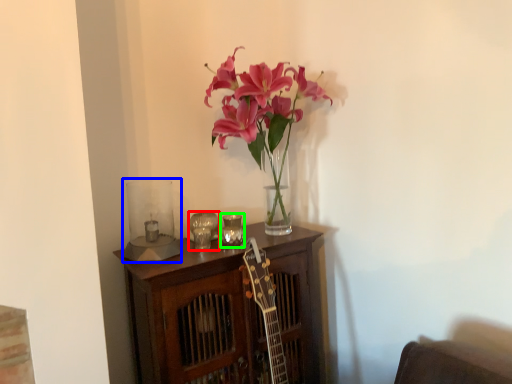
Question: Based on their relative distances, which object is nearer to candle holder (highlighted by a red box)? Choose from candle holder (highlighted by a blue box) and candle holder (highlighted by a green box).

Choices:
 (A) candle holder
 (B) candle holder

Answer: (B)